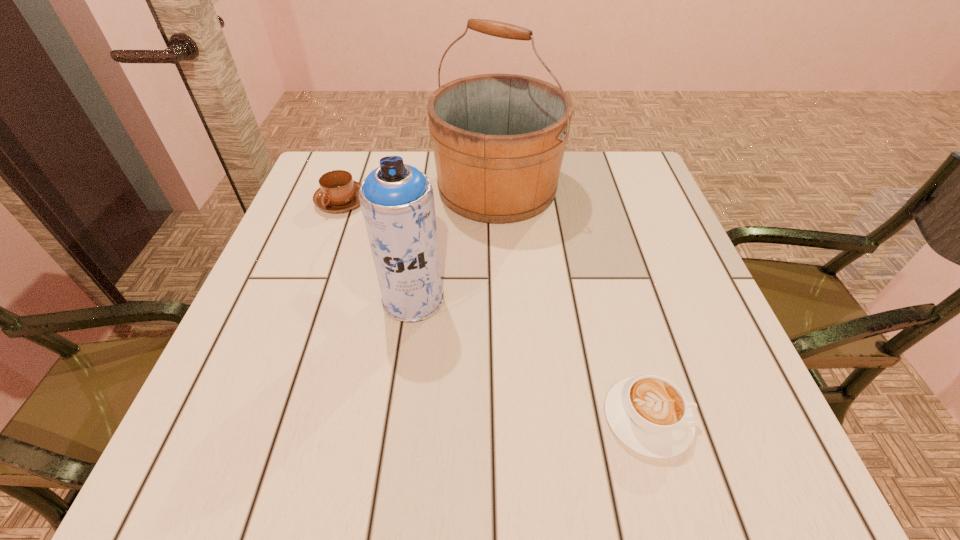
Where is `vacant space at the right edge of the desktop`? This screenshot has height=540, width=960. vacant space at the right edge of the desktop is located at coordinates (626, 209).

In the image, there is a desktop. At what (x,y) coordinates should I click in order to perform the action: click on vacant space at the far left corner. Please return your answer as a coordinate pair (x, y). This screenshot has height=540, width=960. Looking at the image, I should click on (341, 169).

In the image, there is a desktop. Where is `vacant region at the far right corner`? The width and height of the screenshot is (960, 540). vacant region at the far right corner is located at coordinates (605, 173).

The height and width of the screenshot is (540, 960). Find the location of `free point between the nearest object and the leftmost object`. free point between the nearest object and the leftmost object is located at coordinates (494, 310).

At what (x,y) coordinates should I click in order to perform the action: click on free space between the tallest object and the nearest object. Please return your answer as a coordinate pair (x, y). Looking at the image, I should click on (572, 303).

Where is `free space between the bucket and the third farthest object`? free space between the bucket and the third farthest object is located at coordinates (455, 243).

This screenshot has width=960, height=540. In order to click on vacant area between the nearer cappuccino and the bucket in this screenshot , I will do `click(572, 303)`.

Where is `free space between the nearest object and the bucket`? free space between the nearest object and the bucket is located at coordinates (572, 303).

The width and height of the screenshot is (960, 540). Identify the location of empty location between the right cappuccino and the bucket. (572, 303).

You are a GUI agent. You are given a task and a screenshot of the screen. Output one action in this format:
    pyautogui.click(x=<x>, y=<y>)
    Task: Click on the object that can be found as the third closest to the right cappuccino
    The image size is (960, 540).
    Given the screenshot: What is the action you would take?
    pyautogui.click(x=338, y=192)